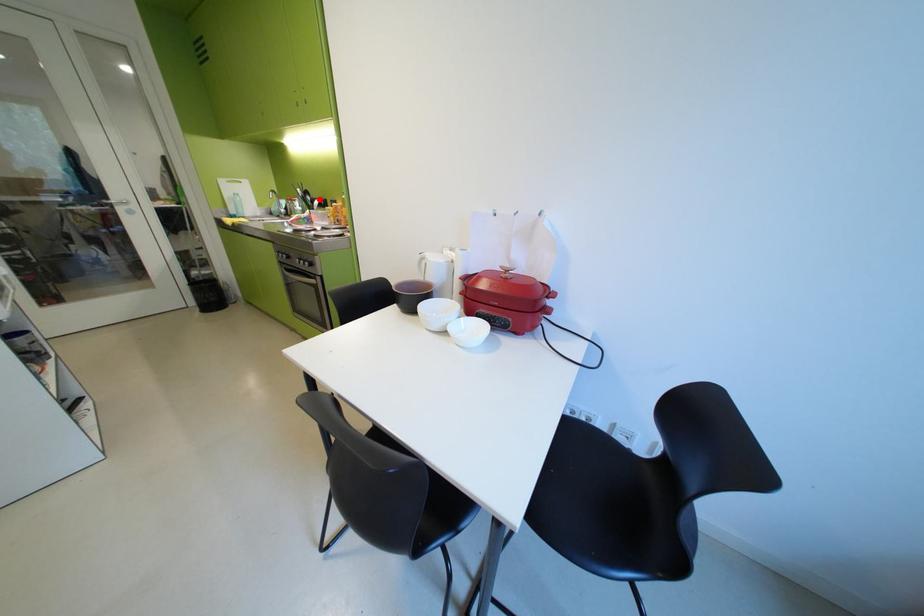
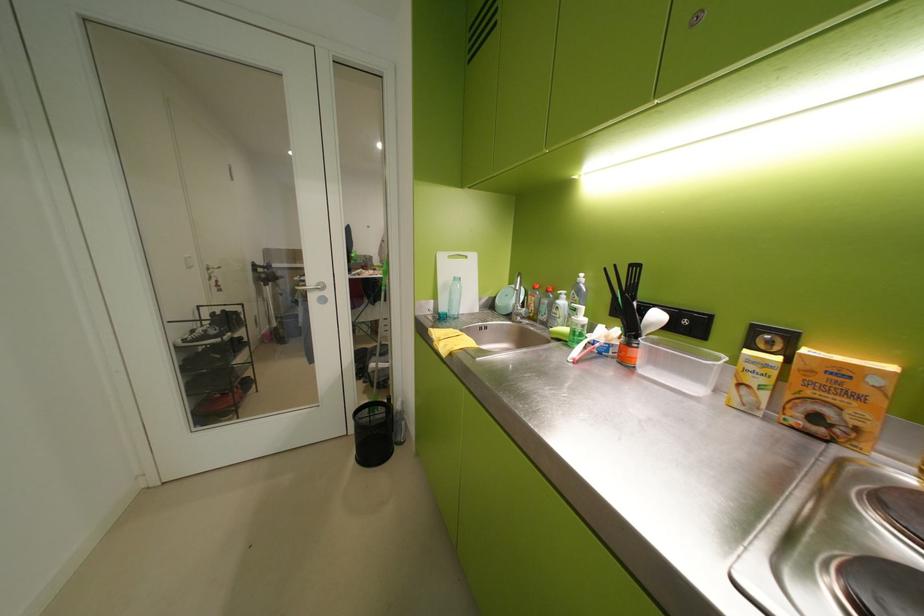
Locate, in the second image, the point that corresponds to the highlighted location in the first image.

(646, 304)